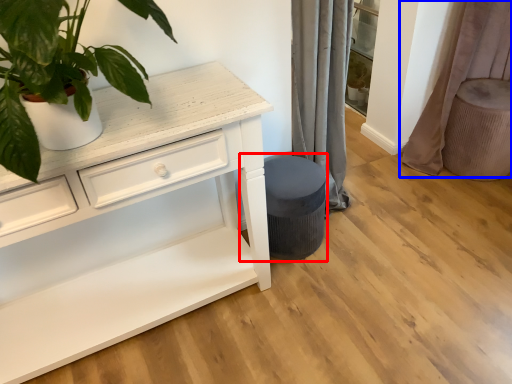
Question: Which object is further to the camera taking this photo, music stool (highlighted by a red box) or curtain (highlighted by a blue box)?

Choices:
 (A) music stool
 (B) curtain

Answer: (B)